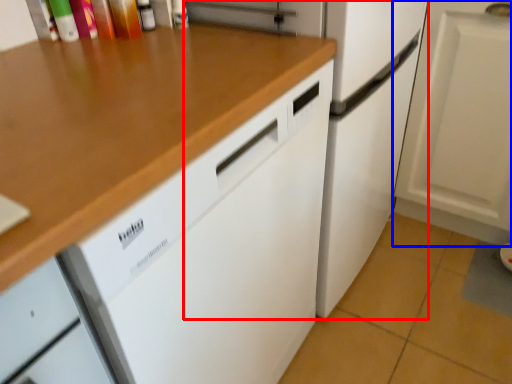
Question: Which object is further to the camera taking this photo, refrigerator (highlighted by a red box) or cabinetry (highlighted by a blue box)?

Choices:
 (A) refrigerator
 (B) cabinetry

Answer: (B)